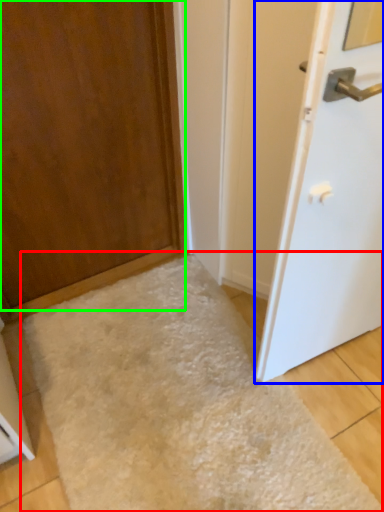
Question: Which object is the closest to the flour (highlighted by a red box)? Choose among these: door (highlighted by a blue box) or door (highlighted by a green box).

Choices:
 (A) door
 (B) door

Answer: (A)